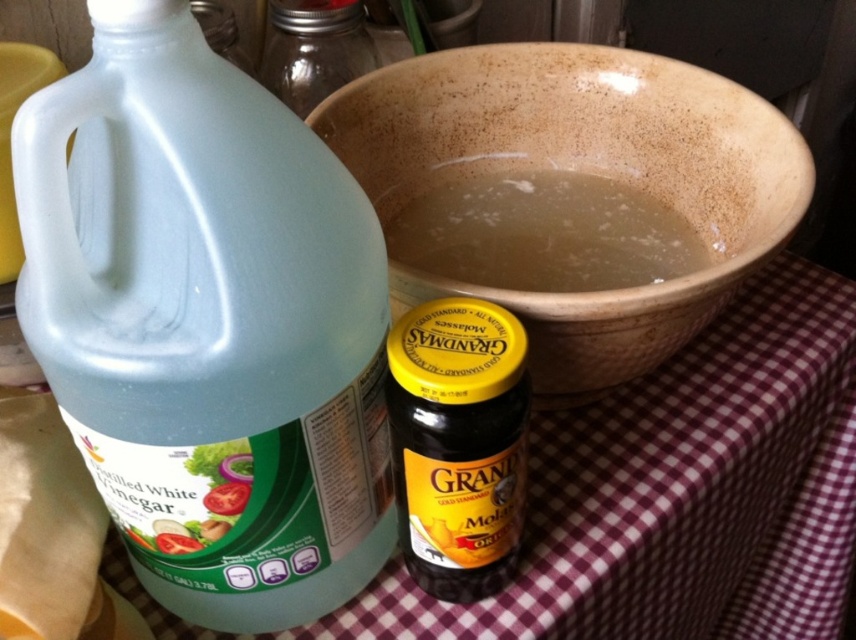
Does point (479, 492) come in front of point (284, 81)?

Yes, it is.

Can you confirm if yellow-golden plastic jar at center is positioned to the right of clear glass jar at upper center?

Indeed, yellow-golden plastic jar at center is positioned on the right side of clear glass jar at upper center.

Who is more distant from viewer, [437,579] or [346,8]?

The point [346,8] is more distant.

At what (x,y) coordinates should I click in order to perform the action: click on yellow-golden plastic jar at center. Please return your answer as a coordinate pair (x, y). The width and height of the screenshot is (856, 640). Looking at the image, I should click on (458, 444).

Is translucent plastic bottle at left below brown stoneware bowl at center?

Indeed, translucent plastic bottle at left is positioned under brown stoneware bowl at center.

Is translucent plastic bottle at left thinner than brown stoneware bowl at center?

Correct, translucent plastic bottle at left's width is less than brown stoneware bowl at center's.

Who is more distant from viewer, (76, 291) or (455, 157)?

Point (455, 157)

The height and width of the screenshot is (640, 856). In order to click on translucent plastic bottle at left in this screenshot , I will do `click(207, 323)`.

Is translucent plastic bottle at left wider than yellow-golden plastic jar at center?

Indeed, translucent plastic bottle at left has a greater width compared to yellow-golden plastic jar at center.

Locate an element on the screen. translucent plastic bottle at left is located at coordinates (207, 323).

At what (x,y) coordinates should I click in order to perform the action: click on translucent plastic bottle at left. Please return your answer as a coordinate pair (x, y). This screenshot has height=640, width=856. Looking at the image, I should click on (207, 323).